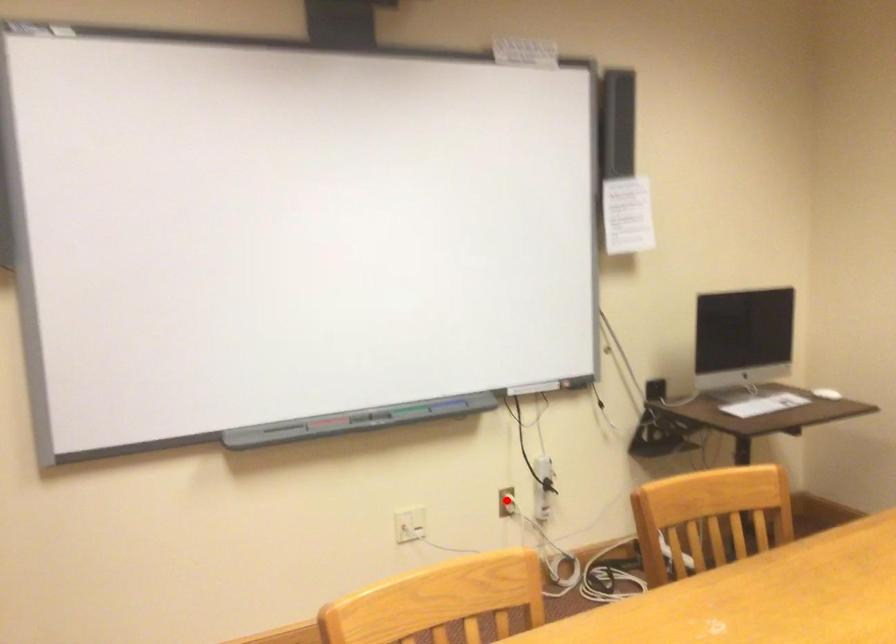
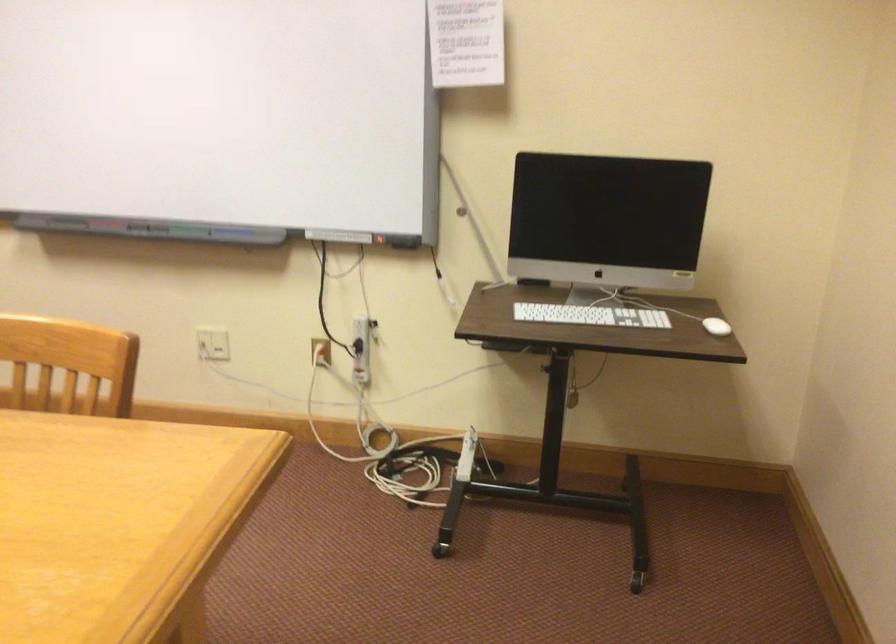
Question: I am providing you with two images of the same scene from different viewpoints. A red point is marked on the first image. At the location where the point appears in image 1, is it still visible in image 2?

Choices:
 (A) Yes
 (B) No

Answer: (A)